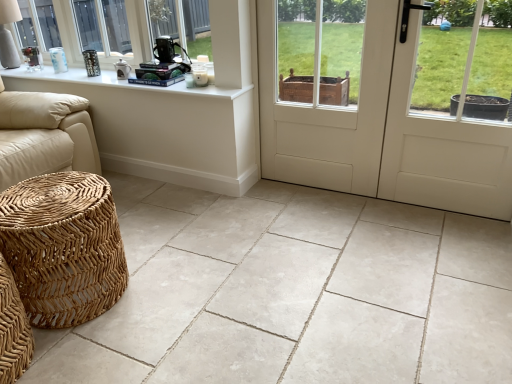
Question: Considering the relative positions of white matte door at center and natural stone tile at lower left in the image provided, is white matte door at center to the left or to the right of natural stone tile at lower left?

Choices:
 (A) right
 (B) left

Answer: (A)

Question: From the image's perspective, relative to natural stone tile at lower left, is white matte door at center above or below?

Choices:
 (A) above
 (B) below

Answer: (A)

Question: Estimate the real-world distances between objects in this image. Which object is farther from the white matte door at center?

Choices:
 (A) woven rattan stool at lower left
 (B) natural stone tile at lower left
 (C) white painted wood at upper left
 (D) white wood screen door at center
 (E) white ceramic table lamp at upper left

Answer: (E)

Question: Estimate the real-world distances between objects in this image. Which object is closer to the white painted wood at upper left?

Choices:
 (A) matte white windowsill at upper left
 (B) white matte door at center
 (C) white ceramic table lamp at upper left
 (D) natural stone tile at lower left
 (E) woven rattan stool at lower left

Answer: (E)